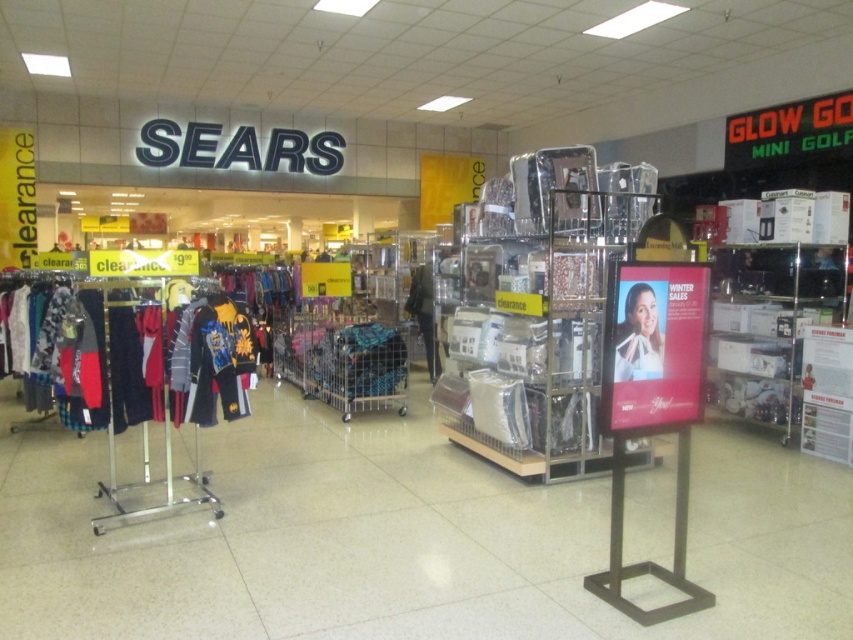
Who is more distant from viewer, (45, 305) or (614, 365)?

Point (45, 305)

Can you confirm if matte black jacket at left is smaller than white fabric dress at center?

Incorrect, matte black jacket at left is not smaller in size than white fabric dress at center.

Is point (146, 410) more distant than point (643, 348)?

Yes, point (146, 410) is behind point (643, 348).

Locate an element on the screen. The width and height of the screenshot is (853, 640). matte black jacket at left is located at coordinates (82, 349).

Which is in front, point (132, 339) or point (436, 344)?

Point (132, 339) is in front.

Can you confirm if matte black jacket at left is taller than black fabric dress at center?

No, matte black jacket at left is not taller than black fabric dress at center.

Image resolution: width=853 pixels, height=640 pixels. What do you see at coordinates (82, 349) in the screenshot?
I see `matte black jacket at left` at bounding box center [82, 349].

Image resolution: width=853 pixels, height=640 pixels. In order to click on matte black jacket at left in this screenshot , I will do `click(82, 349)`.

Which is more to the right, white fabric dress at center or black fabric dress at center?

white fabric dress at center is more to the right.

Does white fabric dress at center have a lesser width compared to black fabric dress at center?

Indeed, white fabric dress at center has a lesser width compared to black fabric dress at center.

Between point (646, 337) and point (438, 372), which one is positioned behind?

Positioned behind is point (438, 372).

Find the location of a particular element. The height and width of the screenshot is (640, 853). white fabric dress at center is located at coordinates (637, 355).